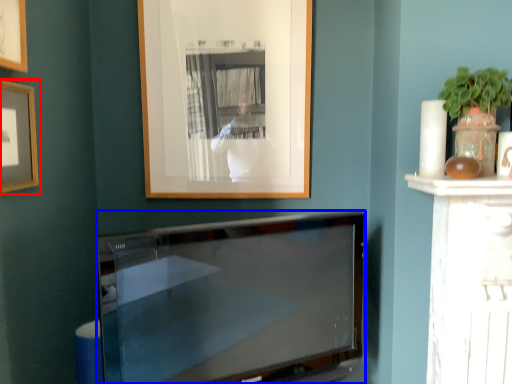
Question: Which of the following is the closest to the observer, picture frame (highlighted by a red box) or television (highlighted by a blue box)?

Choices:
 (A) picture frame
 (B) television

Answer: (A)